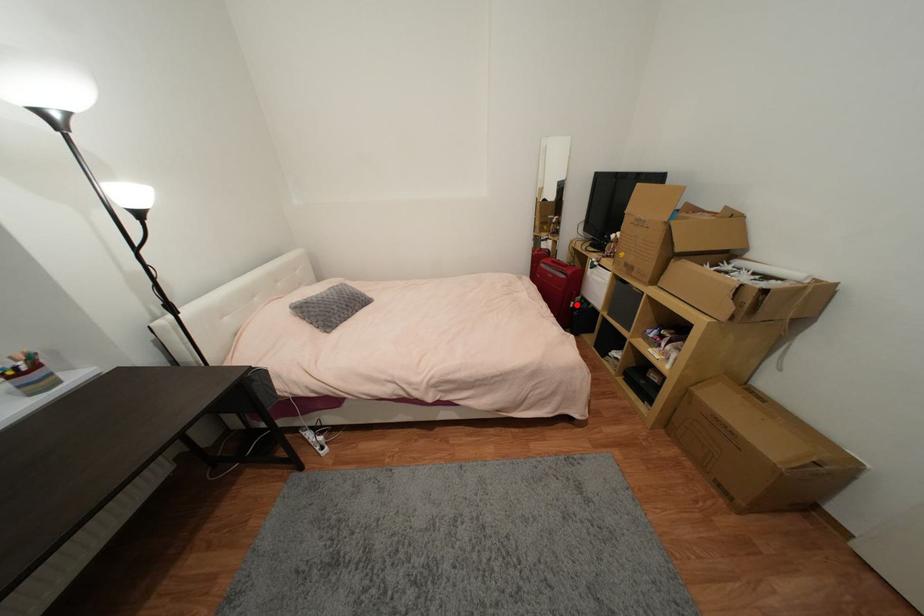
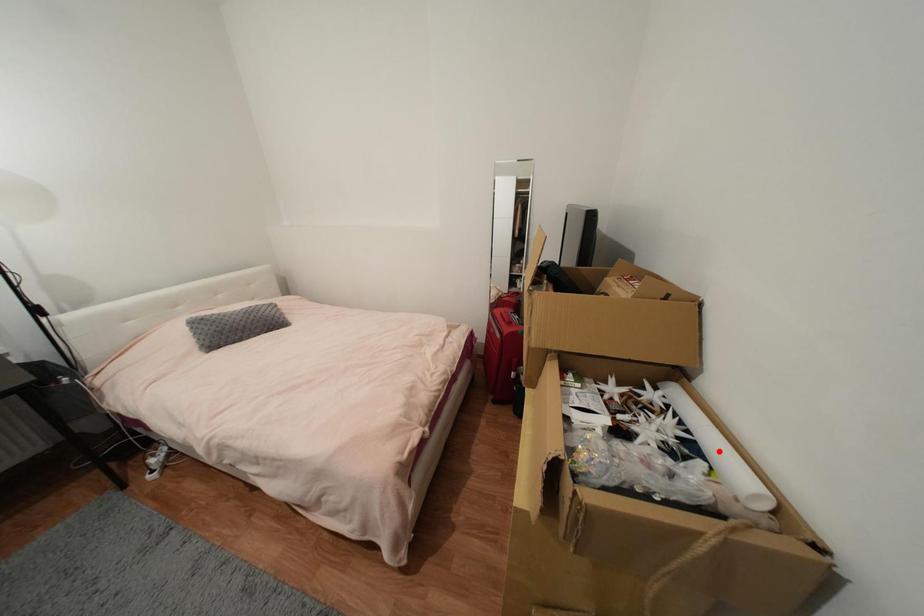
I am providing you with two images of the same scene from different viewpoints. A red point is marked on the first image and another point is marked on the second image. Are the points marked in image1 and image2 representing the same 3D position?

No